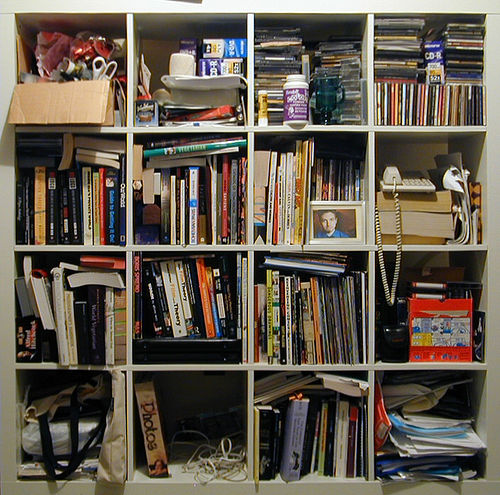
Where is `red books`? The height and width of the screenshot is (495, 500). red books is located at coordinates (225, 205), (274, 232), (253, 336), (206, 327), (113, 263), (101, 212).